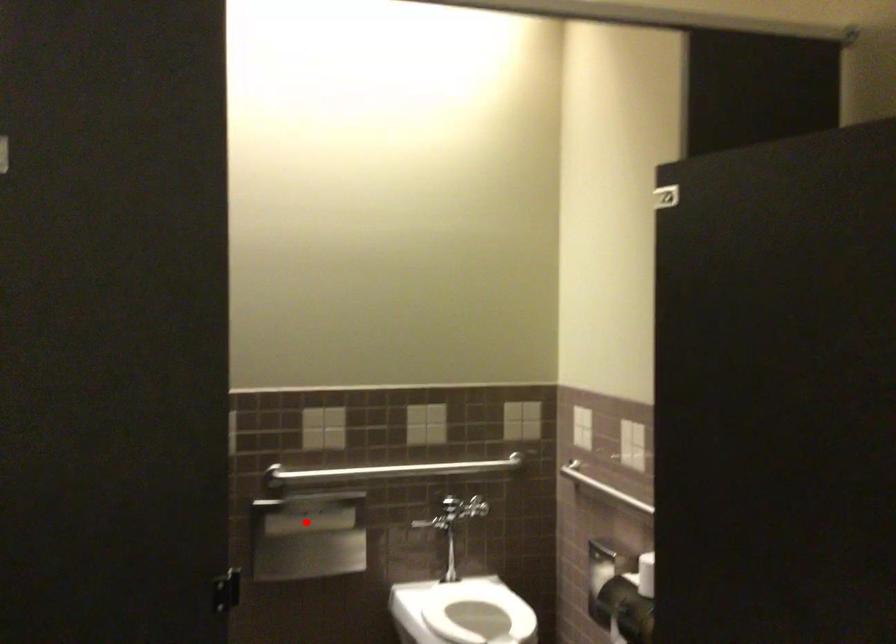
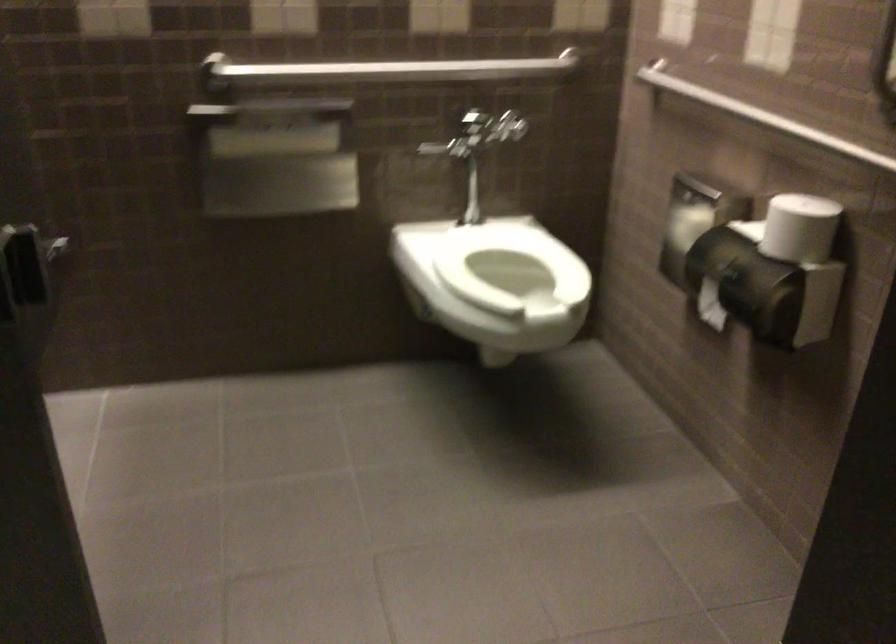
Question: I am providing you with two images of the same scene from different viewpoints. A red point is marked on the first image. At the location where the point appears in image 1, is it still visible in image 2?

Choices:
 (A) Yes
 (B) No

Answer: (A)